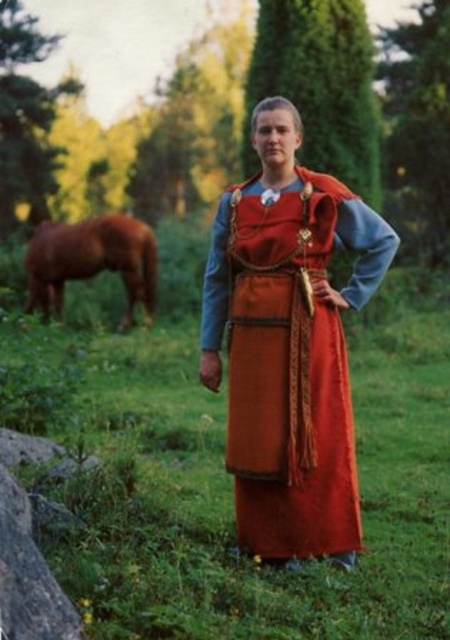
Does matte orange dress at center appear over brown glossy horse at left?

Incorrect, matte orange dress at center is not positioned above brown glossy horse at left.

Is point (288, 124) in front of point (54, 275)?

Yes, it is.

Find the location of a particular element. matte orange dress at center is located at coordinates (288, 342).

Is green grass at center above brown glossy horse at left?

Incorrect, green grass at center is not positioned above brown glossy horse at left.

Can you confirm if green grass at center is taller than brown glossy horse at left?

No, green grass at center is not taller than brown glossy horse at left.

Is point (377, 470) in front of point (134, 276)?

Yes, it is in front of point (134, 276).

Where is `green grass at center`? This screenshot has height=640, width=450. green grass at center is located at coordinates (232, 480).

Is point (409, 548) in front of point (288, 554)?

No, it is not.

Is green grass at center smaller than matte orange dress at center?

Indeed, green grass at center has a smaller size compared to matte orange dress at center.

Who is more distant from viewer, (x=135, y=356) or (x=233, y=269)?

The point (x=135, y=356) is more distant.

Find the location of a particular element. The image size is (450, 640). green grass at center is located at coordinates (232, 480).